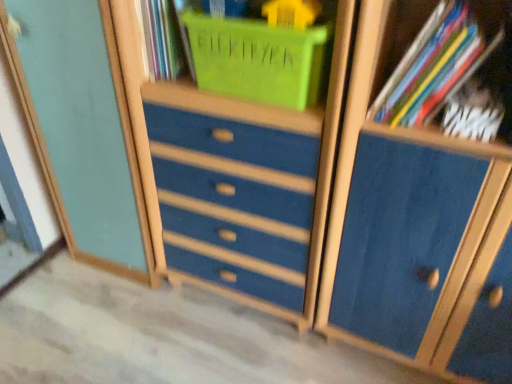
Question: In the image, is multicolored paper at upper right, which is the 1th book in top-to-bottom order, positioned in front of or behind matte blue cabinet at left?

Choices:
 (A) behind
 (B) front

Answer: (B)

Question: Is multicolored paper at upper right, which is the 1th book in top-to-bottom order, inside or outside of matte blue cabinet at left?

Choices:
 (A) outside
 (B) inside

Answer: (A)

Question: Which object is positioned closest to the matte blue cabinet at left?

Choices:
 (A) blue painted wood dresser at center
 (B) matte plastic basket at upper center
 (C) multicolored paper at upper right, which is the 1th book in top-to-bottom order
 (D) blue matte cabinet at center
 (E) white matte book at upper right, which is counted as the second book, starting from the top

Answer: (A)

Question: Estimate the real-world distances between objects in this image. Which object is closer to the white matte book at upper right, which is counted as the second book, starting from the top?

Choices:
 (A) blue painted wood dresser at center
 (B) matte blue cabinet at left
 (C) matte plastic basket at upper center
 (D) blue matte cabinet at center
 (E) multicolored paper at upper right, which is the 1th book in top-to-bottom order

Answer: (E)